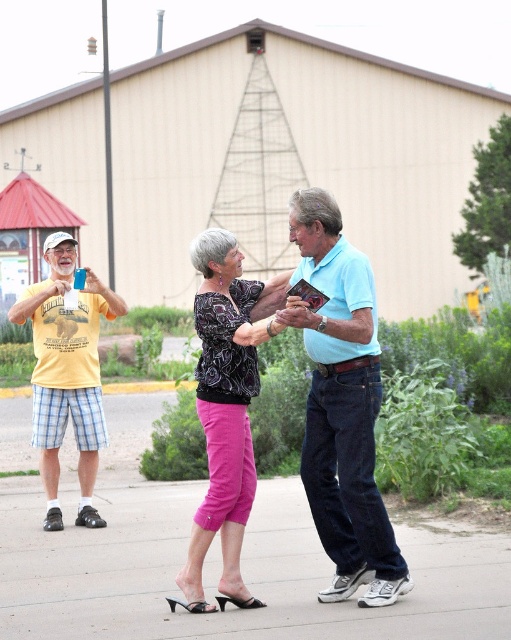
You are a delivery drone that needs to drop off a package to the recipient. You see the pink fabric pants at lower center and the light blue cotton shirt at center in the scene. The minimum distance required for safe landing is 2 meters. Can you safely land between them?

The pink fabric pants at lower center and the light blue cotton shirt at center are 2.13 meters apart, which is more than the required 2 meters. Therefore, you can safely land between them.

From the picture: You are standing at point (368, 460) and want to walk to the building with the triangular roof. Which direction should you go relative to point (55, 545)?

Since point (55, 545) is behind point (368, 460), you should walk towards the building in the direction away from point (55, 545).